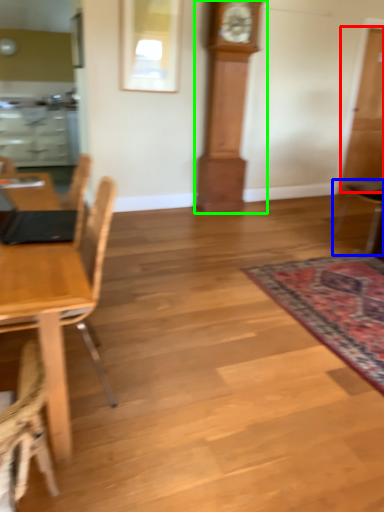
Question: Which is farther away from glass door (highlighted by a red box)? chair (highlighted by a blue box) or clock (highlighted by a green box)?

Choices:
 (A) chair
 (B) clock

Answer: (B)